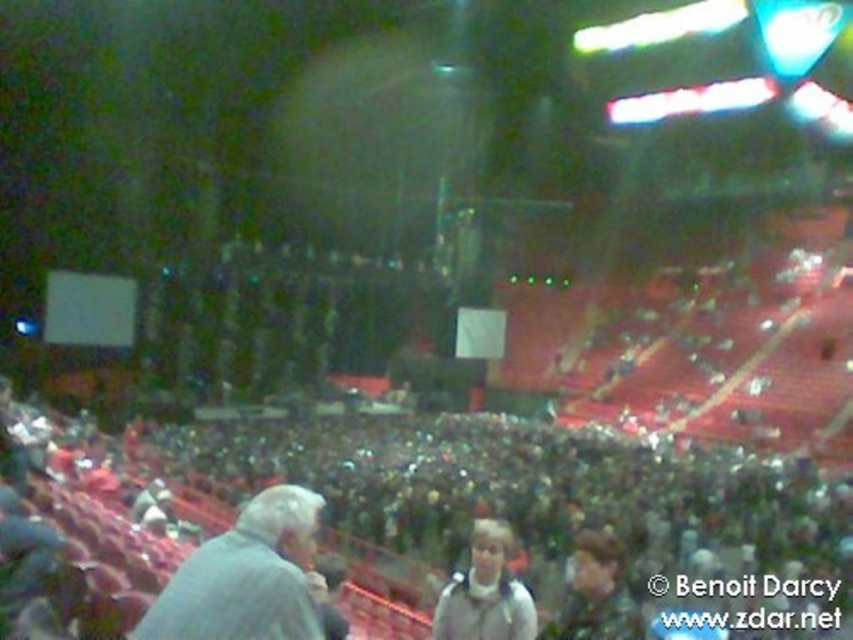
Question: Which point appears farthest from the camera in this image?

Choices:
 (A) (491, 605)
 (B) (614, 504)
 (C) (263, 532)

Answer: (B)

Question: Is the position of dark gray crowd at center more distant than that of white fleece jacket at center?

Choices:
 (A) yes
 (B) no

Answer: (B)

Question: Which object appears closest to the camera in this image?

Choices:
 (A) dark gray crowd at center
 (B) gray wool sweater at lower left

Answer: (B)

Question: Which of the following is the closest to the observer?

Choices:
 (A) (245, 548)
 (B) (482, 614)

Answer: (A)

Question: Is dark gray crowd at center to the right of light gray hoodie at center from the viewer's perspective?

Choices:
 (A) no
 (B) yes

Answer: (A)

Question: Considering the relative positions of dark gray crowd at center and light gray hoodie at center in the image provided, where is dark gray crowd at center located with respect to light gray hoodie at center?

Choices:
 (A) left
 (B) right

Answer: (A)